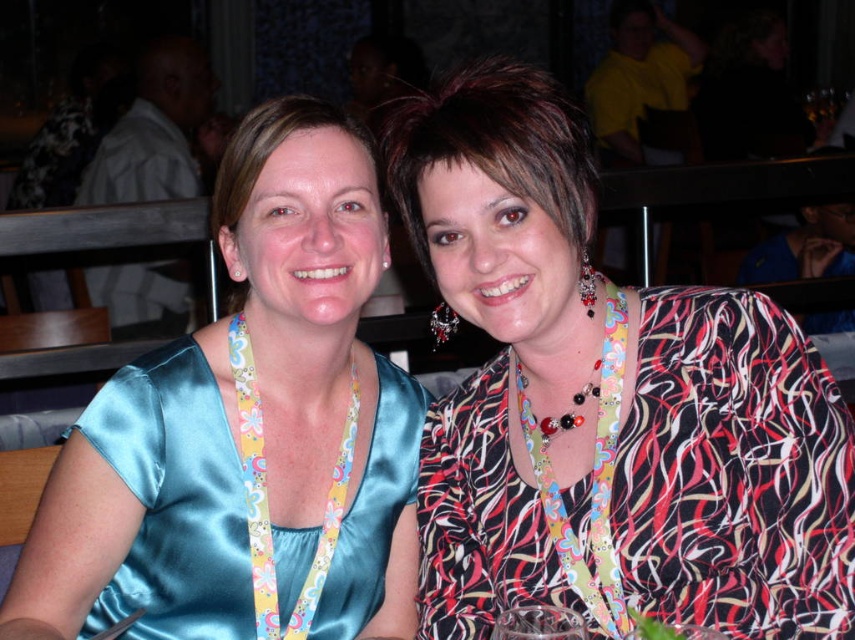
Question: Which object is closer to the camera taking this photo?

Choices:
 (A) satin blue dress at center
 (B) satin dress at left

Answer: (A)

Question: Which point appears farthest from the camera in this image?

Choices:
 (A) (127, 580)
 (B) (671, 468)

Answer: (A)

Question: Is satin blue dress at center smaller than satin dress at left?

Choices:
 (A) yes
 (B) no

Answer: (B)

Question: Is satin blue dress at center to the left of satin dress at left from the viewer's perspective?

Choices:
 (A) no
 (B) yes

Answer: (A)

Question: Is the position of printed silk blouse at center less distant than that of satin blue dress at center?

Choices:
 (A) no
 (B) yes

Answer: (B)

Question: Which object is closer to the camera taking this photo?

Choices:
 (A) printed silk blouse at center
 (B) satin dress at left

Answer: (A)